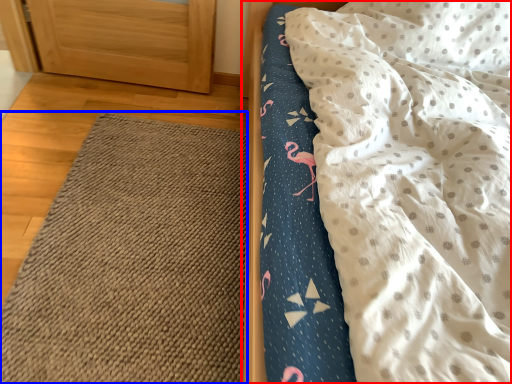
Question: Among these objects, which one is nearest to the camera, bed (highlighted by a red box) or mat (highlighted by a blue box)?

Choices:
 (A) bed
 (B) mat

Answer: (A)